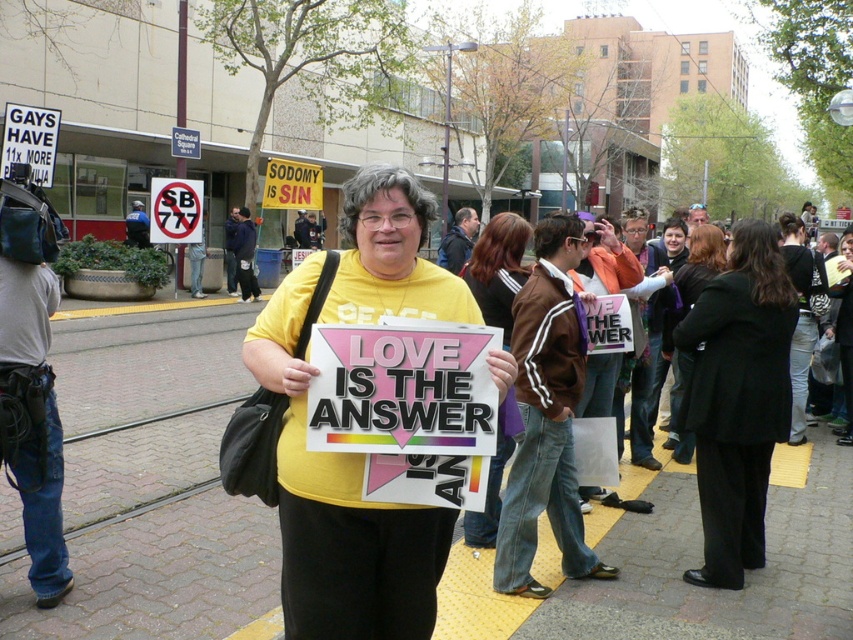
You are a photographer at the protest and want to capture both the black wool coat at center and the black leather jacket at center in a single frame. Which clothing item should you focus on to ensure both are visible in the photo?

The black wool coat at center is smaller than the black leather jacket at center, so focusing on the black wool coat at center would allow both items to fit within the frame since it takes up less space.

You are standing in the middle of the street and see the brick pavement at center and the black wool coat at center. Which object is closer to you?

The brick pavement at center is closer to the viewer than the black wool coat at center, so the brick pavement at center is closer to you.